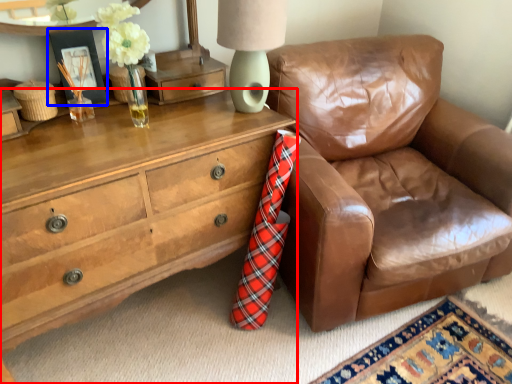
Question: Which object appears closest to the camera in this image, chest of drawers (highlighted by a red box) or picture frame (highlighted by a blue box)?

Choices:
 (A) chest of drawers
 (B) picture frame

Answer: (A)